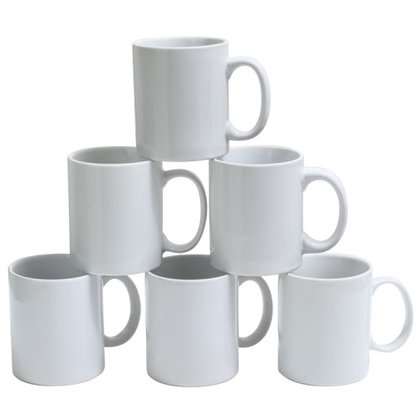
Locate an element on the screen. The height and width of the screenshot is (420, 420). coffee mugs is located at coordinates (65, 346), (212, 334), (321, 336), (112, 210), (253, 232), (197, 91).